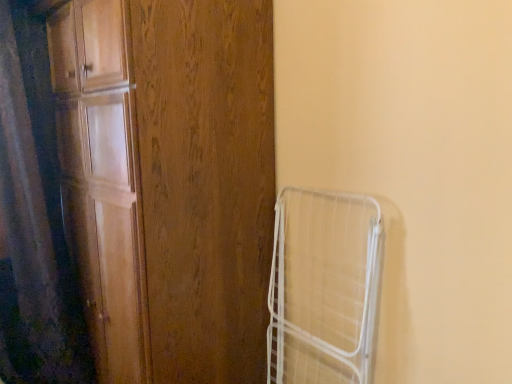
Question: Is point (288, 187) positioned closer to the camera than point (67, 109)?

Choices:
 (A) closer
 (B) farther

Answer: (A)

Question: From their relative heights in the image, would you say white wire cage at right is taller or shorter than wooden door at left?

Choices:
 (A) short
 (B) tall

Answer: (A)

Question: Considering the real-world distances, which object is closest to the wooden door at left?

Choices:
 (A) white wire cage at right
 (B) black matte shower curtain at left

Answer: (A)

Question: Considering the real-world distances, which object is farthest from the white wire cage at right?

Choices:
 (A) black matte shower curtain at left
 (B) wooden door at left

Answer: (A)